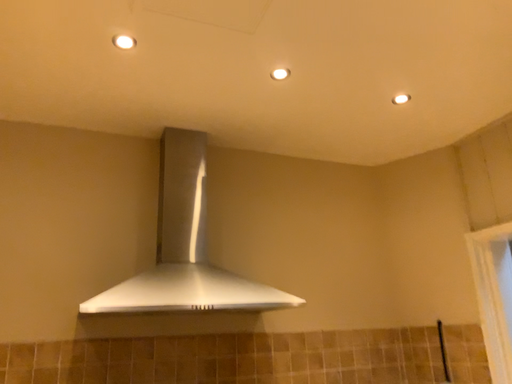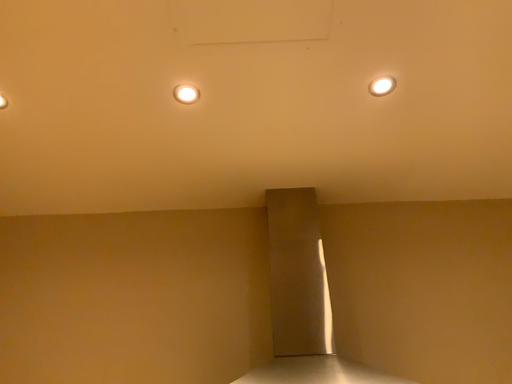
Question: How did the camera likely rotate when shooting the video?

Choices:
 (A) rotated downward
 (B) rotated upward

Answer: (B)